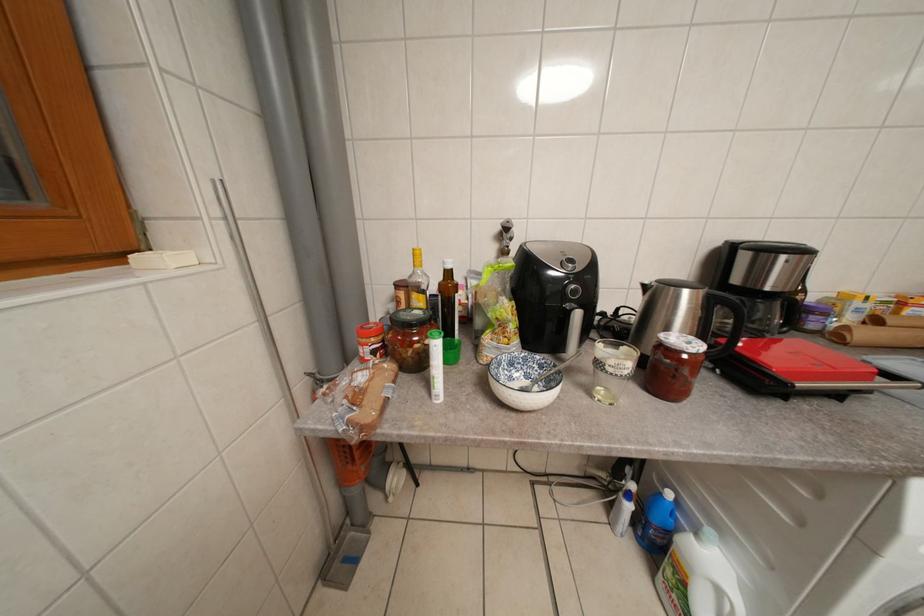
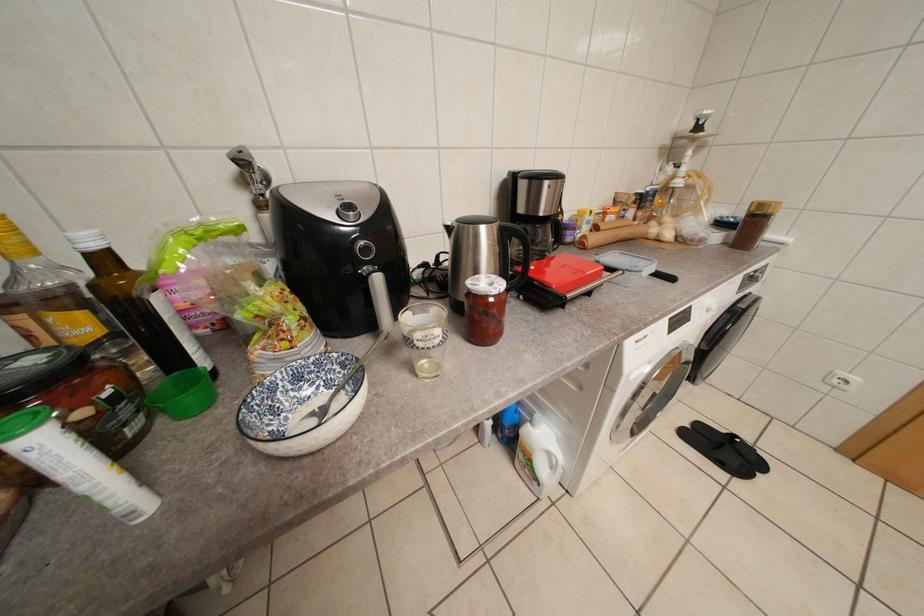
Question: The first image is from the beginning of the video and the second image is from the end. How did the camera likely rotate when shooting the video?

Choices:
 (A) Left
 (B) Right
 (C) Up
 (D) Down

Answer: (B)